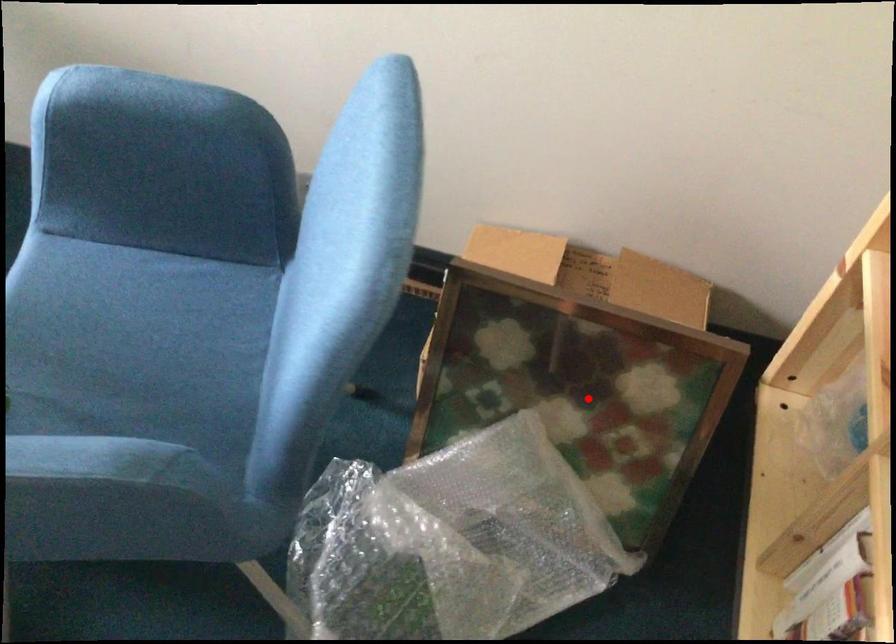
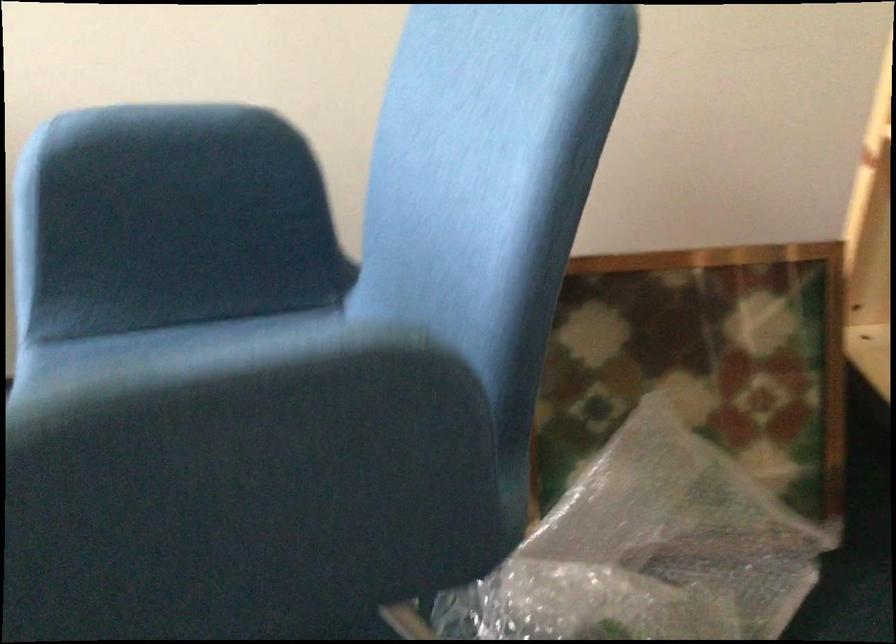
In the second image, find the point that corresponds to the highlighted location in the first image.

(702, 363)